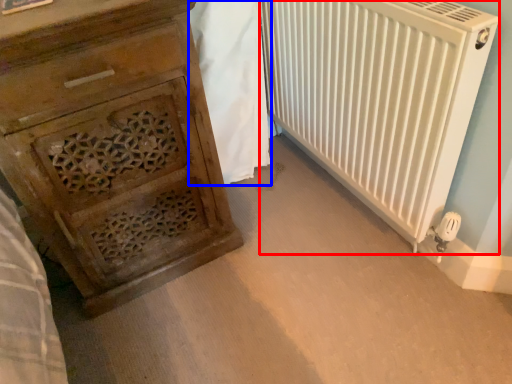
Question: Among these objects, which one is farthest to the camera, radiator (highlighted by a red box) or blanket (highlighted by a blue box)?

Choices:
 (A) radiator
 (B) blanket

Answer: (B)